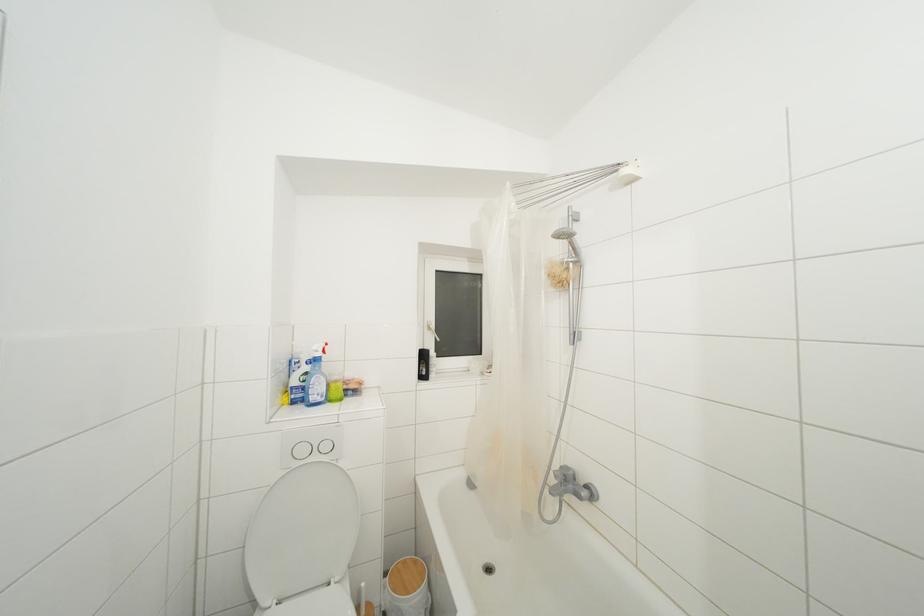
Where would you lift the black plastic bottle? Please return your answer as a coordinate pair (x, y).

(423, 363)